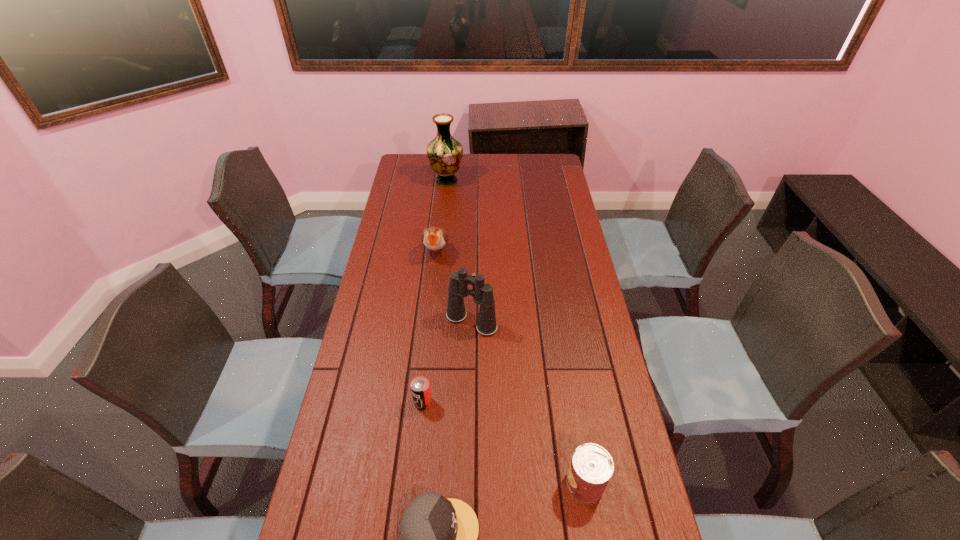
This screenshot has height=540, width=960. I want to click on vase, so click(x=444, y=152).

I want to click on the tallest object, so click(444, 152).

Find the location of `the second tallest object`. the second tallest object is located at coordinates (482, 293).

Find the location of a particular element. The image size is (960, 540). binoculars is located at coordinates (482, 293).

I want to click on the fourth shortest object, so click(x=434, y=238).

The image size is (960, 540). Identify the location of bird. (434, 238).

Find the location of a particular element. the taller can is located at coordinates (591, 467).

Locate an element on the screen. The height and width of the screenshot is (540, 960). the rightmost object is located at coordinates (591, 467).

Where is `the left can`? the left can is located at coordinates (420, 387).

The width and height of the screenshot is (960, 540). I want to click on the fifth tallest object, so click(420, 387).